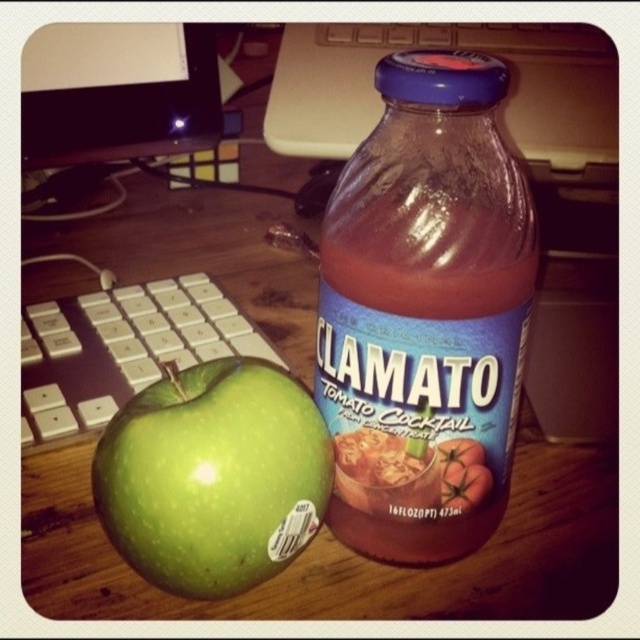
Who is taller, translucent glass bottle at center or green matte apple at lower left?

With more height is translucent glass bottle at center.

Is point (380, 246) more distant than point (188, 456)?

Yes, point (380, 246) is farther from viewer.

Find the location of a particular element. Image resolution: width=640 pixels, height=640 pixels. translucent glass bottle at center is located at coordinates (424, 312).